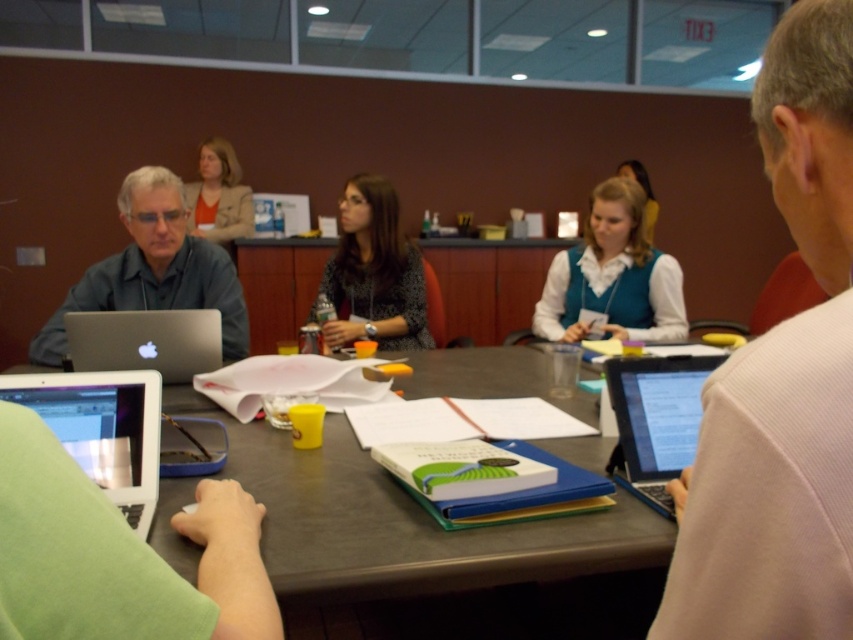
Which of these two, smooth gray table at center or matte beige blazer at upper center, stands taller?

With more height is matte beige blazer at upper center.

Is point (360, 516) closer to camera compared to point (225, 221)?

That is True.

Image resolution: width=853 pixels, height=640 pixels. Find the location of `smooth gray table at center`. smooth gray table at center is located at coordinates (431, 550).

Consider the image. Who is more forward, (131, 250) or (132, 422)?

Point (132, 422)

Is the position of matte black laptop at left less distant than that of white glossy laptop at lower left?

That is False.

Image resolution: width=853 pixels, height=640 pixels. Identify the location of matte black laptop at left. (154, 269).

Who is positioned more to the right, silver metallic laptop at right or matte beige blazer at upper center?

From the viewer's perspective, silver metallic laptop at right appears more on the right side.

Between silver metallic laptop at right and matte beige blazer at upper center, which one has less height?

With less height is silver metallic laptop at right.

What do you see at coordinates (654, 420) in the screenshot?
I see `silver metallic laptop at right` at bounding box center [654, 420].

Locate an element on the screen. This screenshot has width=853, height=640. silver metallic laptop at right is located at coordinates (654, 420).